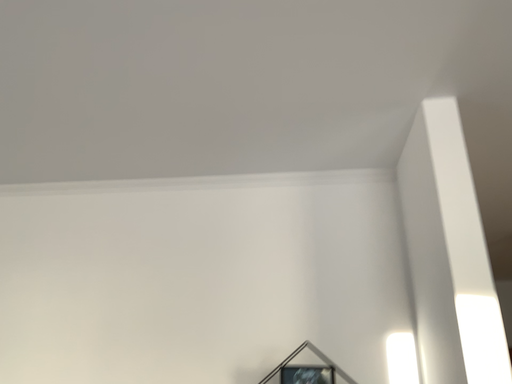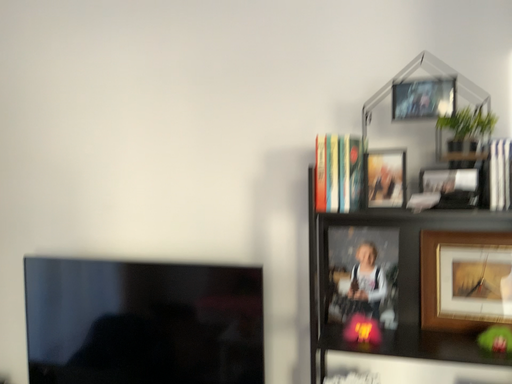
Question: How did the camera likely rotate when shooting the video?

Choices:
 (A) rotated downward
 (B) rotated upward

Answer: (A)